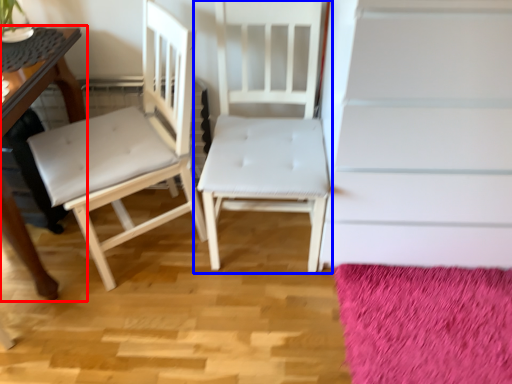
Question: Which of the following is the farthest to the observer, table (highlighted by a red box) or chair (highlighted by a blue box)?

Choices:
 (A) table
 (B) chair

Answer: (B)